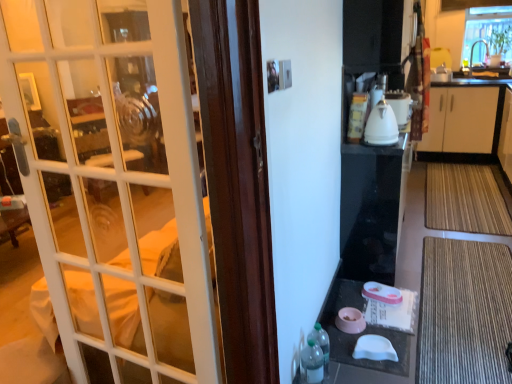
You are a GUI agent. You are given a task and a screenshot of the screen. Output one action in this format:
    pyautogui.click(x=<x>, y=<y>)
    Task: Click on the blank space situated above pink plastic table at lower center (from a real-world perspective)
    This screenshot has height=384, width=512.
    Given the screenshot: What is the action you would take?
    pyautogui.click(x=368, y=313)